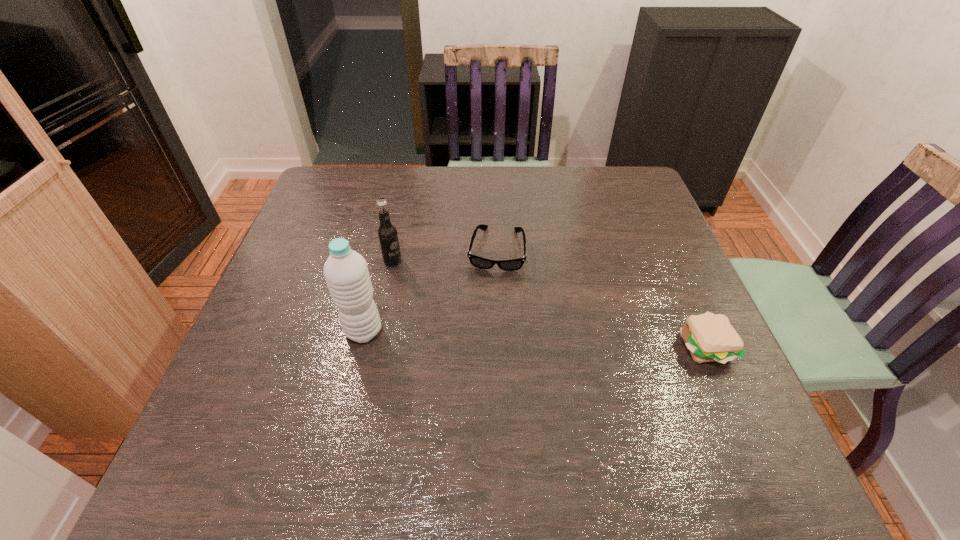
This screenshot has height=540, width=960. Identify the location of water bottle. (346, 273).

Where is `patty`? Image resolution: width=960 pixels, height=540 pixels. patty is located at coordinates (709, 337).

You are a GUI agent. You are given a task and a screenshot of the screen. Output one action in this format:
    pyautogui.click(x=<x>, y=<y>)
    Task: Click on the rightmost object
    Image resolution: width=960 pixels, height=540 pixels.
    Given the screenshot: What is the action you would take?
    709,337

The height and width of the screenshot is (540, 960). I want to click on the second tallest object, so click(x=387, y=234).

Find the location of `sunglasses`. sunglasses is located at coordinates (514, 264).

The width and height of the screenshot is (960, 540). I want to click on the third object from left to right, so click(x=514, y=264).

The height and width of the screenshot is (540, 960). Find the location of `vacant space located 0.070m on the right of the water bottle`. vacant space located 0.070m on the right of the water bottle is located at coordinates (414, 331).

Where is `blank space located on the left of the patty`? blank space located on the left of the patty is located at coordinates (561, 346).

Find the location of a particular element. Image resolution: width=960 pixels, height=540 pixels. free space located on the label of the second tallest object is located at coordinates (x=414, y=274).

I want to click on vacant space situated on the label of the second tallest object, so click(x=469, y=308).